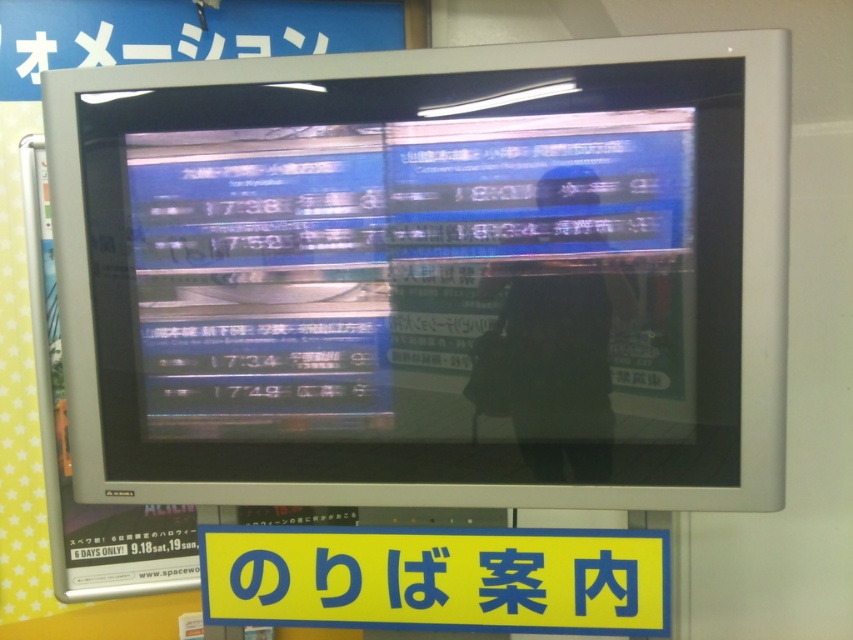
From the picture: You are standing in front of a CRT television screen displaying train schedules. You notice a yellow matte sign at center and a dark gray fabric man at center. Which object is closer to you?

The yellow matte sign at center is closer to you because it is further to the viewer than the dark gray fabric man at center.

You are standing in front of the CRT television screen and want to touch both points on the screen. Which point should you reach for first, the point at coordinate (228, 596) or the point at coordinate (541, 452)?

You should reach for the point at coordinate (228, 596) first because it is closer to you than the point at coordinate (541, 452).